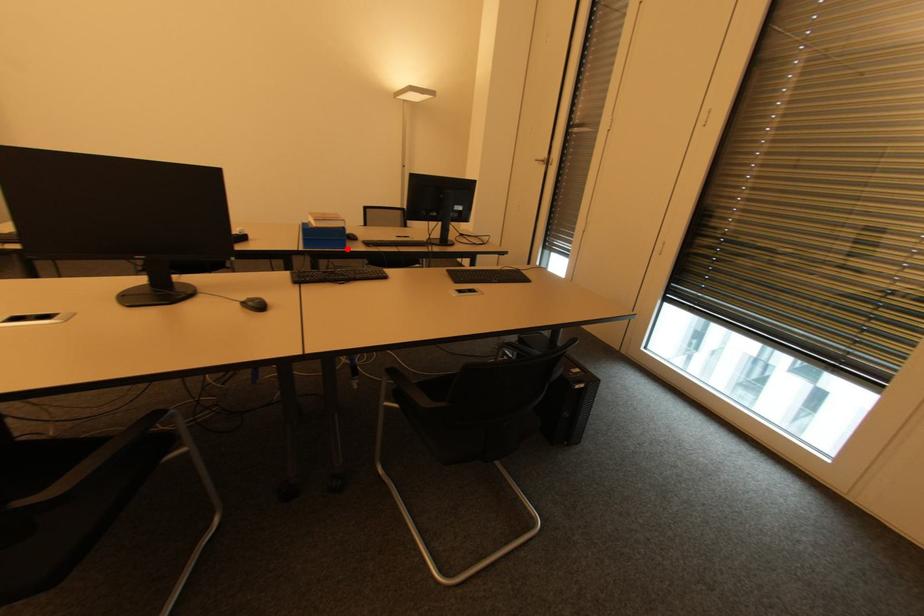
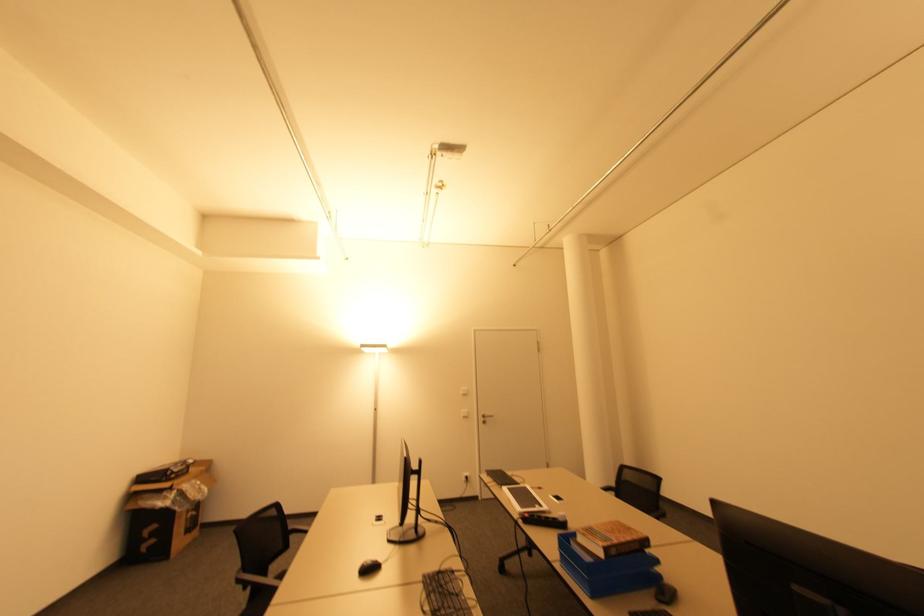
The point at the highlighted location is marked in the first image. Where is the corresponding point in the second image?

(594, 597)